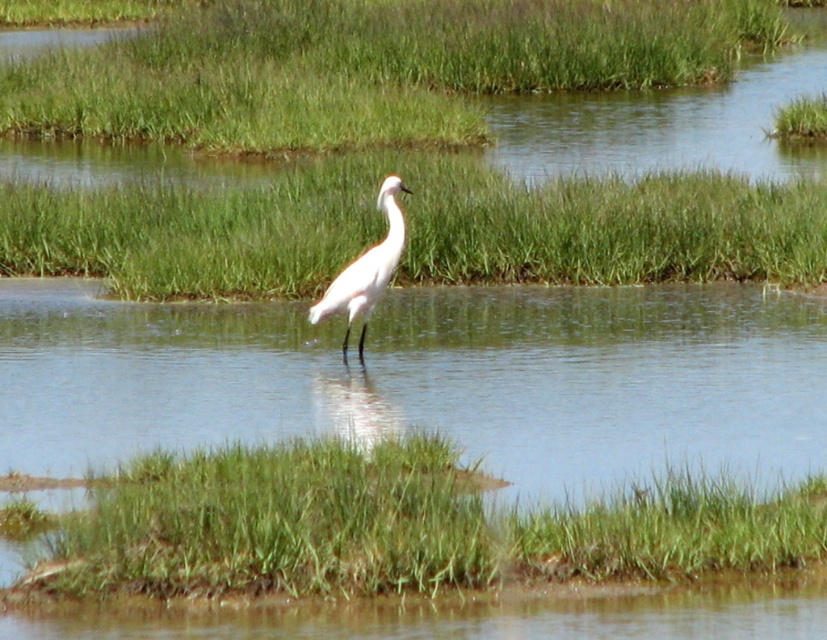
You are a frog jumping from the green grass at center to the green grassy at lower center. Which direction should you jump to reach the lower grass?

The green grassy at lower center is located below the green grass at center, so you should jump downward to reach the lower grass.

You are standing at the edge of the wetland and see the green grassy at lower center and the green grass at center. Which one is located to the right side of the other?

The green grassy at lower center is located to the right of the green grass at center.